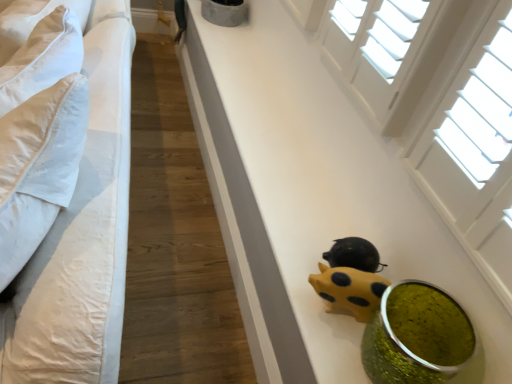
Question: Is yellow matte piggy bank at lower center inside or outside of green glittery vase at lower right?

Choices:
 (A) inside
 (B) outside

Answer: (B)

Question: In terms of size, does yellow matte piggy bank at lower center appear bigger or smaller than green glittery vase at lower right?

Choices:
 (A) big
 (B) small

Answer: (B)

Question: Which is nearer to the yellow matte piggy bank at lower center?

Choices:
 (A) yellow matte piggy bank at lower center
 (B) white cotton bed at left
 (C) green glittery vase at lower right

Answer: (C)

Question: Which of these objects is positioned closest to the green glittery vase at lower right?

Choices:
 (A) yellow matte piggy bank at lower center
 (B) yellow matte piggy bank at lower center
 (C) white cotton bed at left

Answer: (A)